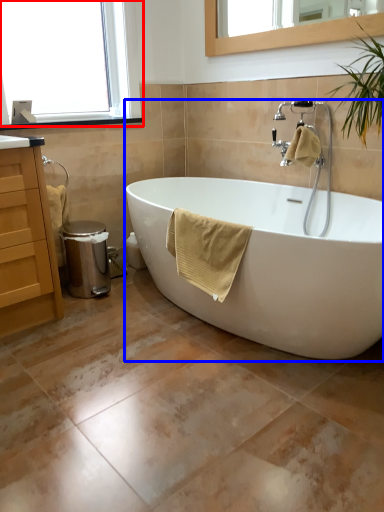
Question: Which object is closer to the camera taking this photo, window (highlighted by a red box) or bathtub (highlighted by a blue box)?

Choices:
 (A) window
 (B) bathtub

Answer: (B)